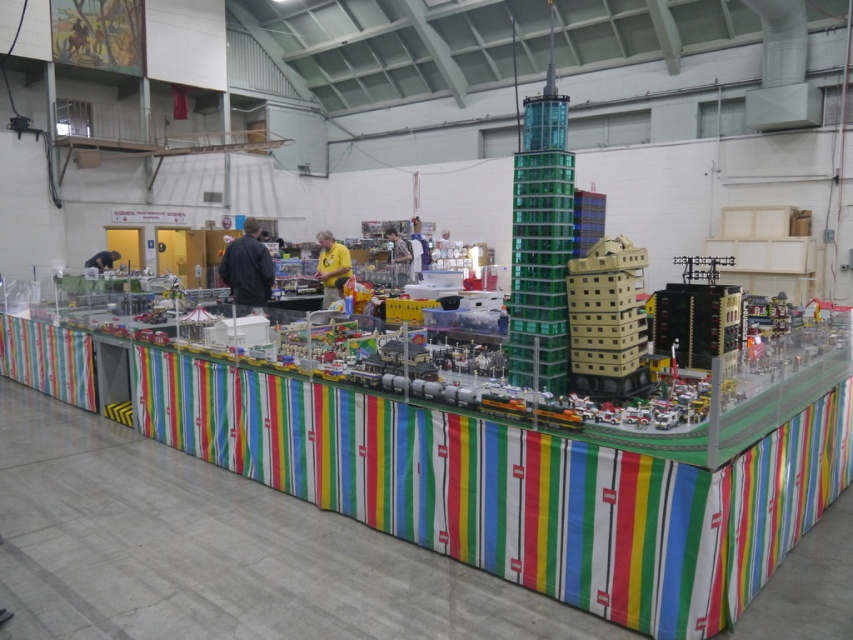
Does transparent green glass tower at center appear on the right side of beige plastic building at center?

In fact, transparent green glass tower at center is to the left of beige plastic building at center.

Does transparent green glass tower at center have a lesser width compared to beige plastic building at center?

Correct, transparent green glass tower at center's width is less than beige plastic building at center's.

Describe the element at coordinates (541, 241) in the screenshot. The height and width of the screenshot is (640, 853). I see `transparent green glass tower at center` at that location.

The width and height of the screenshot is (853, 640). Identify the location of transparent green glass tower at center. (541, 241).